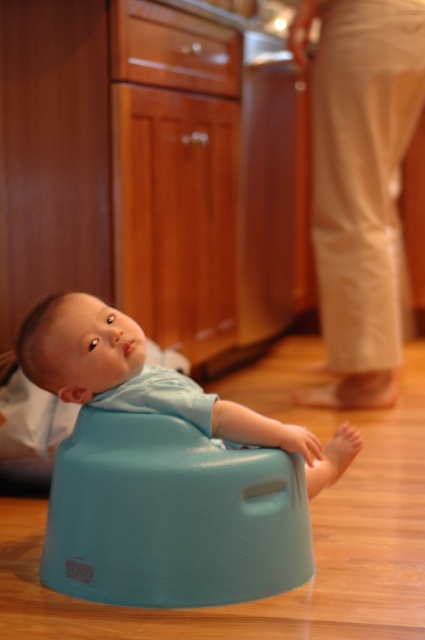
You are a parent trying to move the matte plastic bumbo seat at lower center and the blue rubber baby seat at center closer to the kitchen cabinets. Which direction should you move each seat to place them near the cabinets?

The matte plastic bumbo seat at lower center is already to the left of the blue rubber baby seat at center. To move them closer to the kitchen cabinets, you should move the matte plastic bumbo seat at lower center to the right and the blue rubber baby seat at center further to the right so both are positioned near the cabinets.

You are a caregiver looking after a baby. You need to move the matte plastic bumbo seat at lower center and the blue rubber baby seat at center to a safer area. Which one should you move first if you want to start with the one that is closer to the ground?

The matte plastic bumbo seat at lower center is located below the blue rubber baby seat at center, so it is closer to the ground. Therefore, you should move the matte plastic bumbo seat at lower center first.

You are a photographer standing at a distance. You need to capture a clear closeup shot of the matte plastic bumbo seat at lower center without moving the baby. The camera you are using has a minimum focusing distance of 1.5 meters. Can you take the photo from your current position?

The matte plastic bumbo seat at lower center and camera are 1.53 meters apart. Since the minimum focusing distance is 1.5 meters, the camera can focus at 1.53 meters, so yes, you can take the photo from your current position.